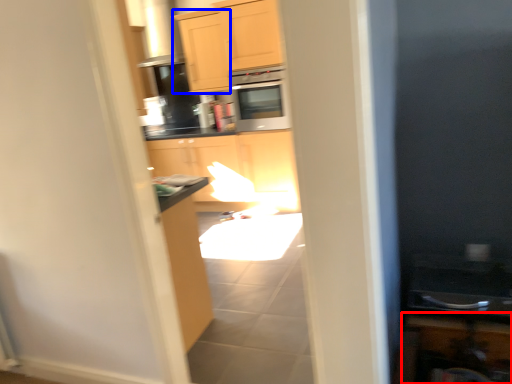
Question: Which object is closer to the camera taking this photo, cabinetry (highlighted by a red box) or cabinetry (highlighted by a blue box)?

Choices:
 (A) cabinetry
 (B) cabinetry

Answer: (A)